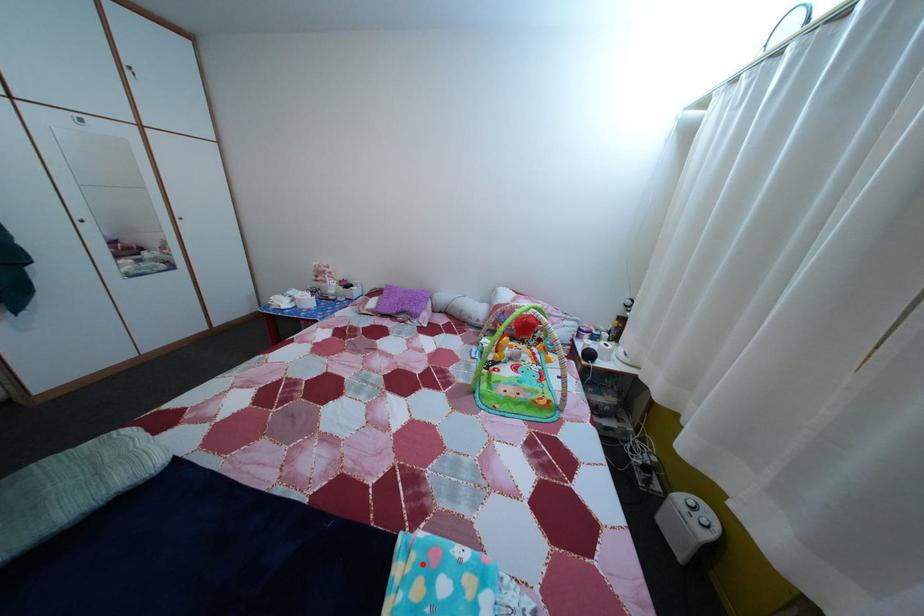
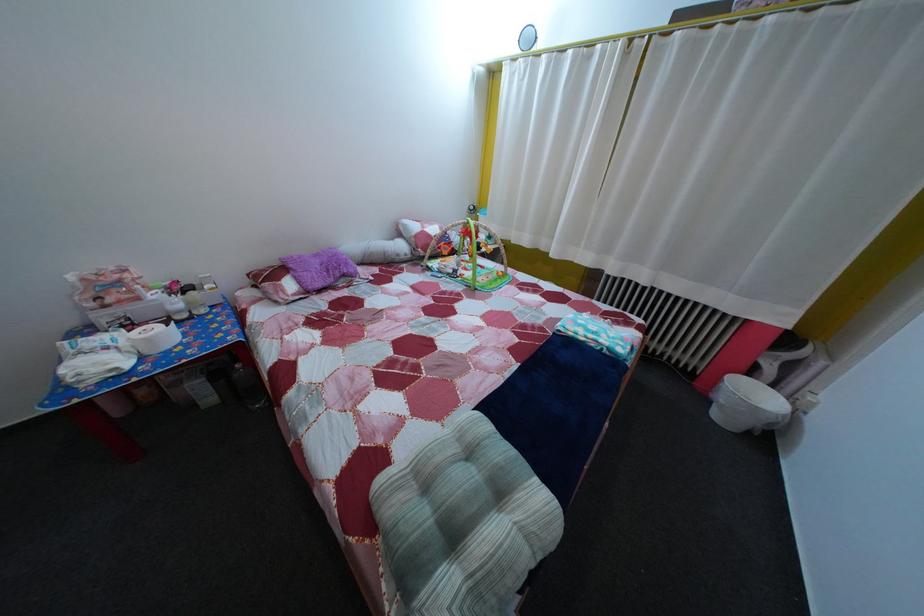
Question: I am providing you with two images of the same scene from different viewpoints. Image1 has a red point marked. In image2, the corresponding 3D location appears at what relative position? Reply with the corresponding letter.

Choices:
 (A) Closer
 (B) Farther

Answer: (A)